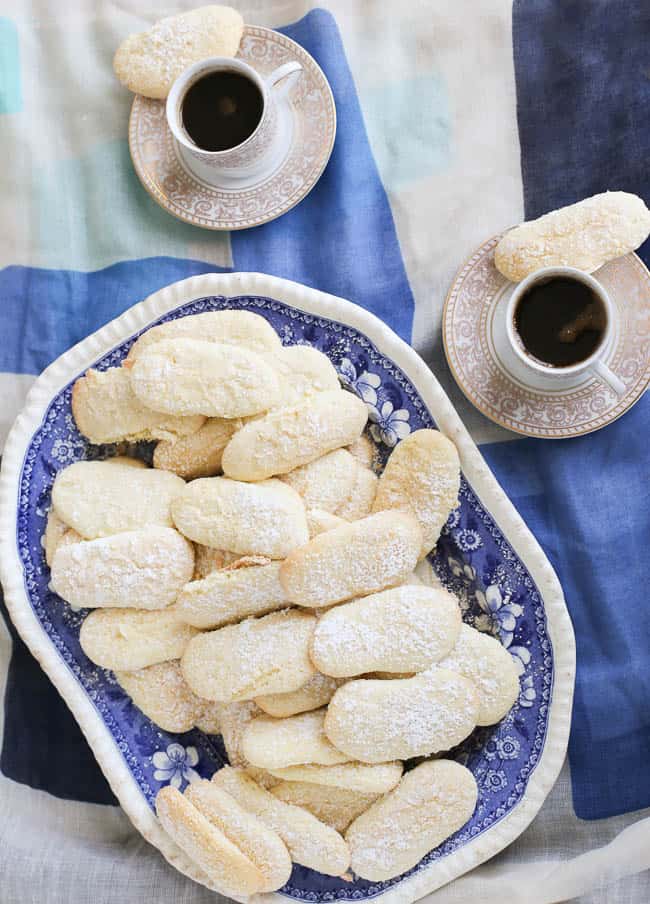
Identify the location of teacup. The image size is (650, 904). click(588, 362), click(263, 136).